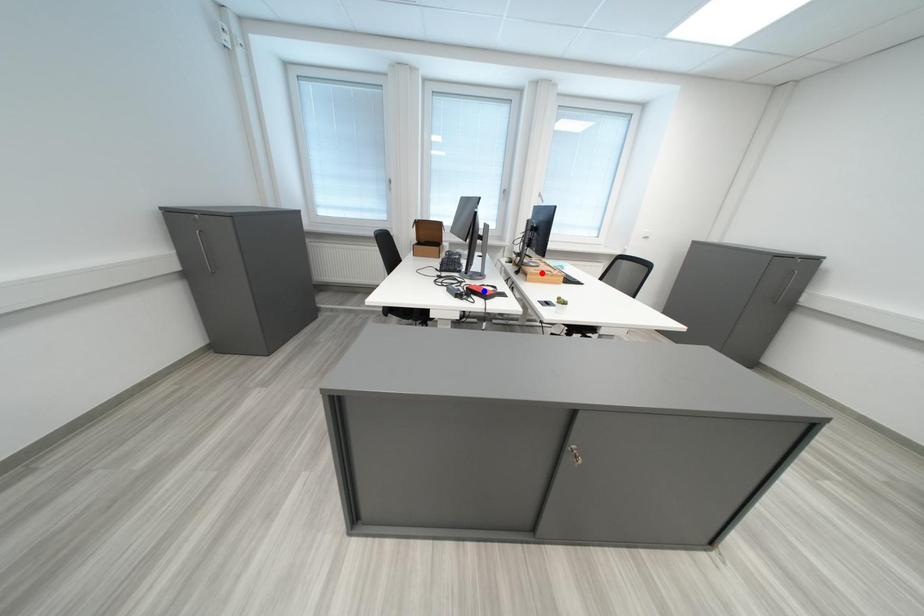
Question: In the image, two points are highlighted. Which point is nearer to the camera? Reply with the corresponding letter.

Choices:
 (A) blue point
 (B) red point

Answer: (A)